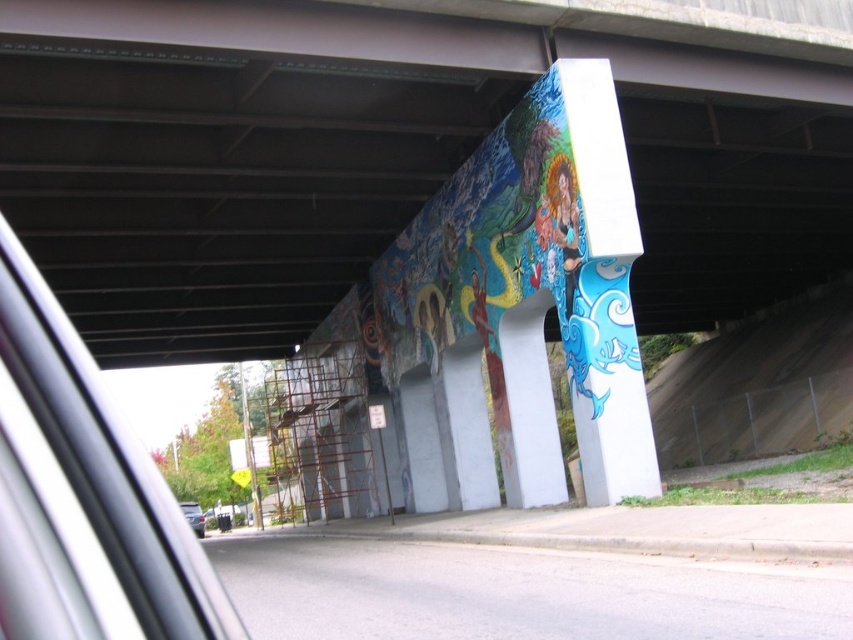
Who is lower down, gray asphalt highway at lower center or transparent glass car window at left?

gray asphalt highway at lower center is lower down.

Find the location of a particular element. gray asphalt highway at lower center is located at coordinates (517, 593).

Image resolution: width=853 pixels, height=640 pixels. What are the coordinates of `gray asphalt highway at lower center` in the screenshot? It's located at (x=517, y=593).

Image resolution: width=853 pixels, height=640 pixels. What do you see at coordinates (396, 150) in the screenshot?
I see `painted mural at center` at bounding box center [396, 150].

Does painted mural at center have a larger size compared to metallic silver car at lower left?

Indeed, painted mural at center has a larger size compared to metallic silver car at lower left.

Does point (334, 100) come farther from viewer compared to point (193, 516)?

No, (334, 100) is closer to viewer.

Locate an element on the screen. Image resolution: width=853 pixels, height=640 pixels. painted mural at center is located at coordinates (396, 150).

Who is positioned more to the left, gray asphalt highway at lower center or white concrete pillar at center?

Positioned to the left is gray asphalt highway at lower center.

Does gray asphalt highway at lower center have a greater width compared to white concrete pillar at center?

Yes.

Measure the distance between point (318, 604) and camera.

Point (318, 604) and camera are 7.34 meters apart.

Find the location of a particular element. The width and height of the screenshot is (853, 640). gray asphalt highway at lower center is located at coordinates (517, 593).